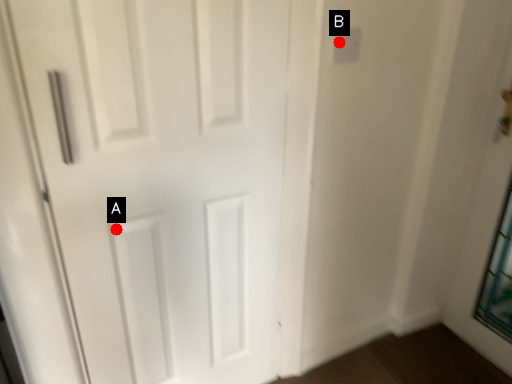
Question: Two points are circled on the image, labeled by A and B beside each circle. Which point is farther from the camera taking this photo?

Choices:
 (A) A is further
 (B) B is further

Answer: (B)